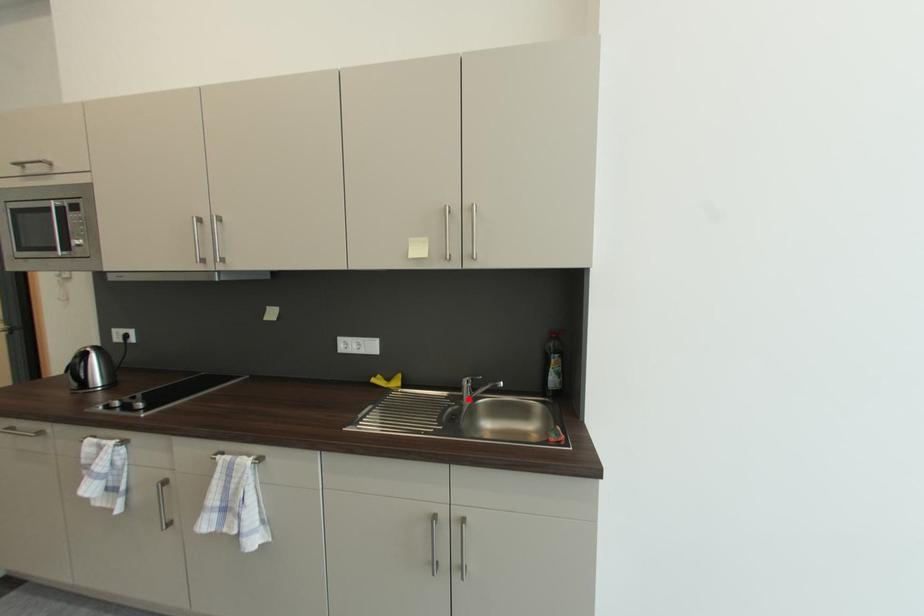
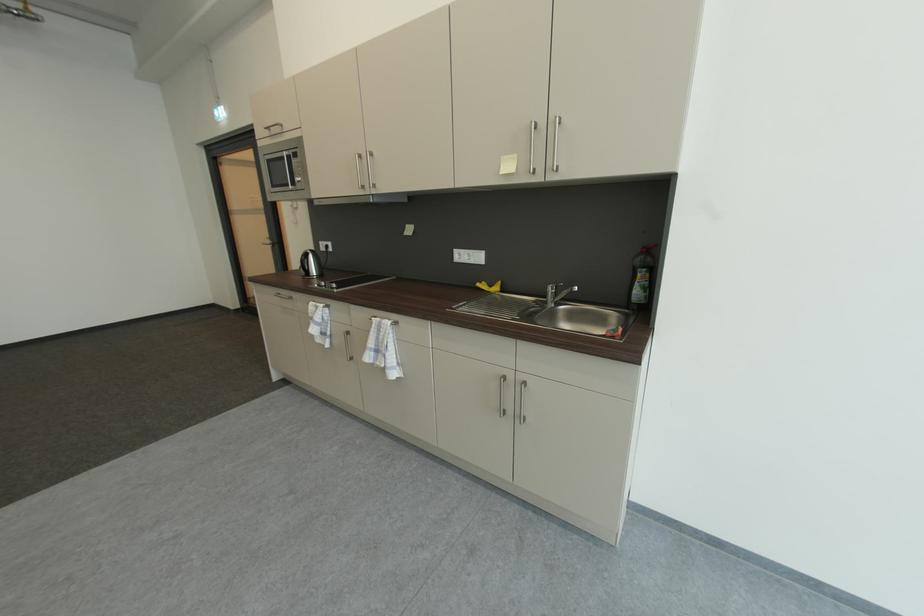
Find the pixel in the second image that matches the highlighted location in the first image.

(553, 304)